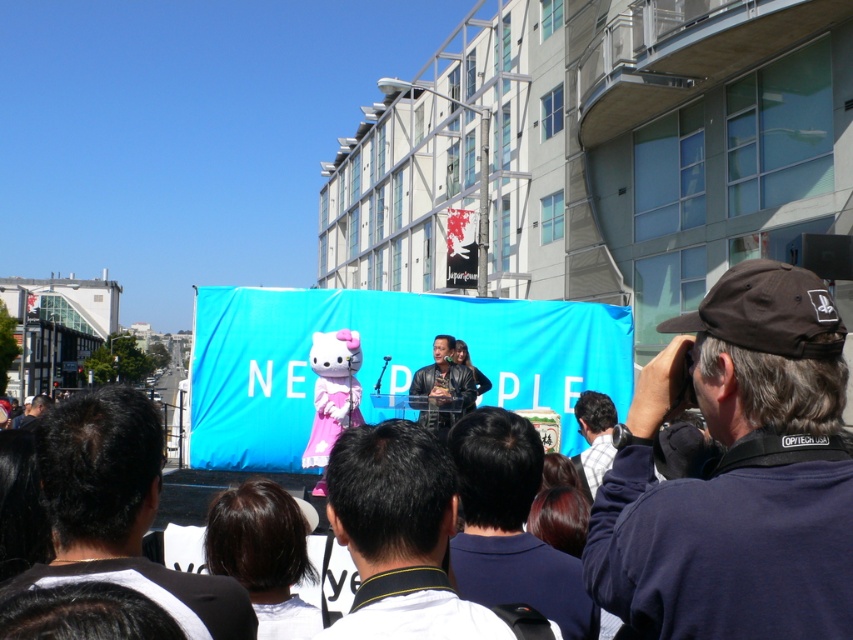
You are a photographer at the event and want to capture a clear photo of both the black fabric at center and the white shirt at center. Based on their positions, which one is closer to the camera?

The black fabric at center is in front of the white shirt at center, so the black fabric at center is closer to the camera.

You are standing at the center of the stage and want to check what is at the point with coordinates [509,524]. What would you find there?

At point [509,524] lies dark blue shirt at center.